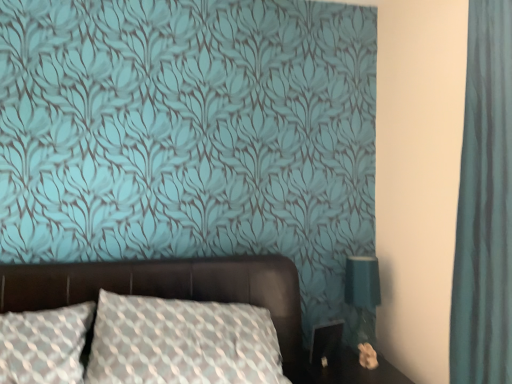
Question: Could teal fabric lampshade at right be considered to be inside teal fabric curtain at right?

Choices:
 (A) no
 (B) yes

Answer: (A)

Question: Does teal fabric curtain at right appear on the right side of teal fabric lampshade at right?

Choices:
 (A) yes
 (B) no

Answer: (A)

Question: Can you confirm if teal fabric curtain at right is positioned to the left of teal fabric lampshade at right?

Choices:
 (A) yes
 (B) no

Answer: (B)

Question: Is teal fabric curtain at right smaller than teal fabric lampshade at right?

Choices:
 (A) no
 (B) yes

Answer: (A)

Question: Is teal fabric curtain at right closer to the viewer compared to teal fabric lampshade at right?

Choices:
 (A) no
 (B) yes

Answer: (B)

Question: Is teal fabric curtain at right facing towards teal fabric lampshade at right?

Choices:
 (A) yes
 (B) no

Answer: (B)

Question: Is the depth of leather bed at center less than that of teal fabric lampshade at right?

Choices:
 (A) no
 (B) yes

Answer: (B)

Question: From the image's perspective, is leather bed at center located beneath teal fabric lampshade at right?

Choices:
 (A) no
 (B) yes

Answer: (A)

Question: Could you tell me if leather bed at center is facing teal fabric lampshade at right?

Choices:
 (A) no
 (B) yes

Answer: (A)

Question: Is leather bed at center oriented away from teal fabric lampshade at right?

Choices:
 (A) yes
 (B) no

Answer: (B)

Question: Considering the relative positions of leather bed at center and teal fabric lampshade at right in the image provided, is leather bed at center to the left of teal fabric lampshade at right from the viewer's perspective?

Choices:
 (A) yes
 (B) no

Answer: (A)

Question: From a real-world perspective, is leather bed at center below teal fabric lampshade at right?

Choices:
 (A) yes
 (B) no

Answer: (B)

Question: Considering the relative sizes of teal fabric lampshade at right and leather bed at center in the image provided, is teal fabric lampshade at right thinner than leather bed at center?

Choices:
 (A) yes
 (B) no

Answer: (A)